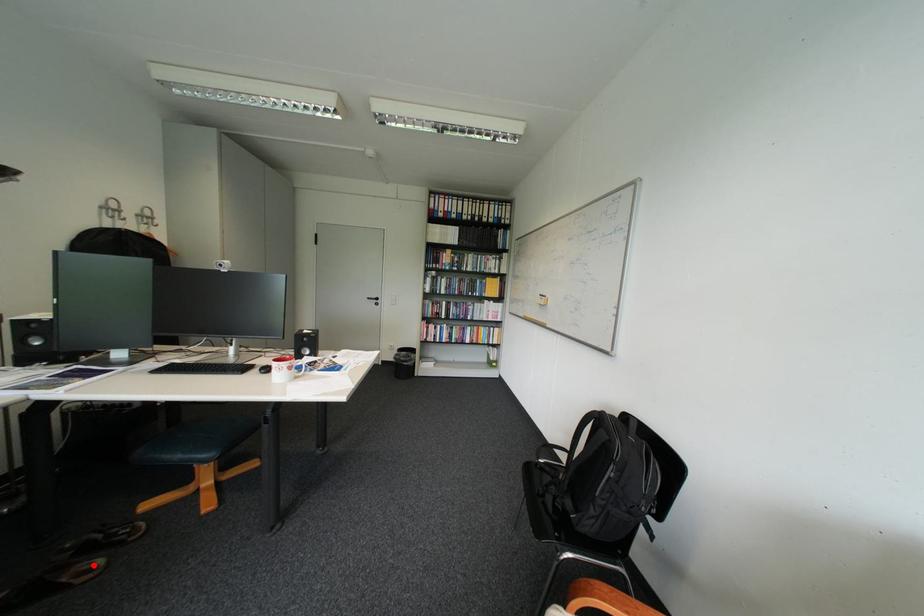
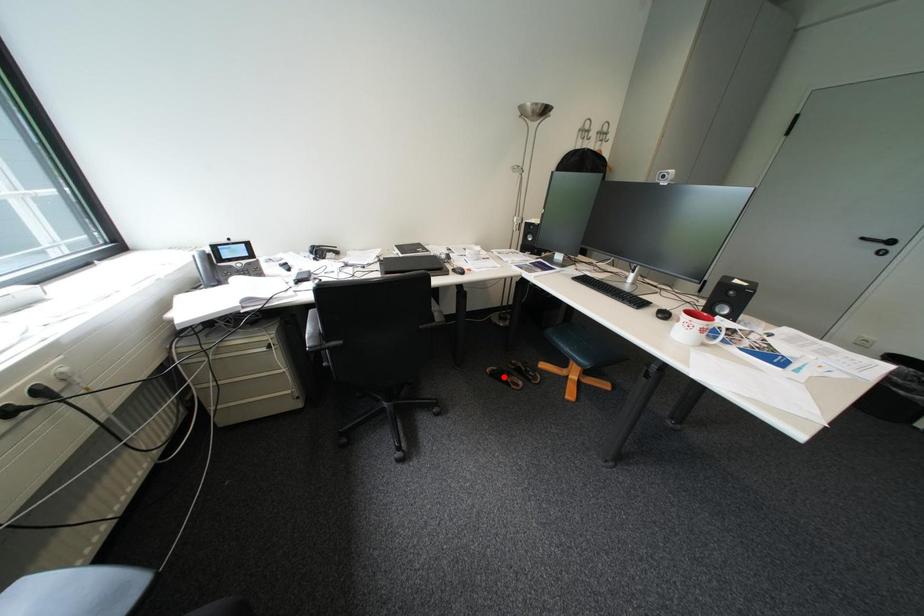
I am providing you with two images of the same scene from different viewpoints. A red point is marked on the first image and another point is marked on the second image. Are the points marked in image1 and image2 representing the same 3D position?

No